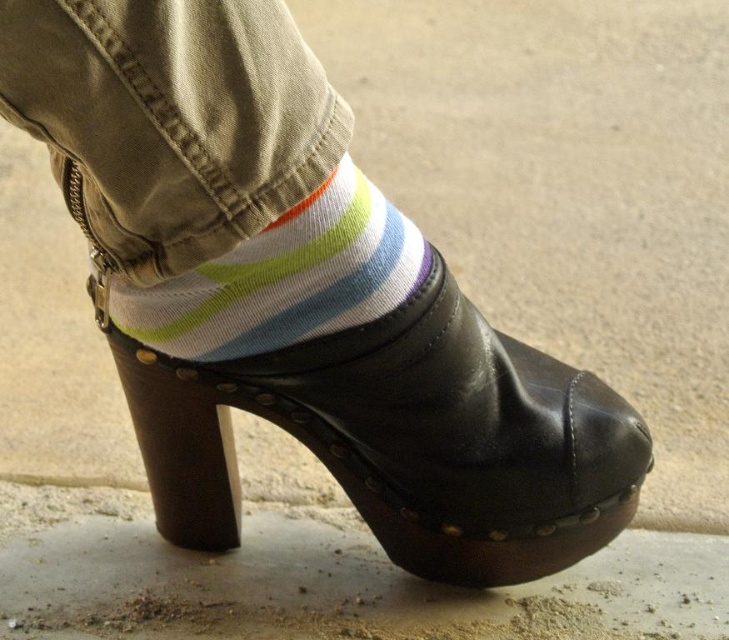
You are trying to put on your black leather clog at center, but you notice your white striped sock at center is in the way. Will the sock need to be pulled down to fit the clog properly?

The black leather clog at center is much taller than the white striped sock at center, so the sock does not need to be pulled down as it will be covered by the clog.

You are trying to put on your shoes but are unsure if your white striped sock at center will fit under the black leather clog at center. Based on the image, can you determine if the sock will fit under the clog?

The black leather clog at center is located below the white striped sock at center, meaning the sock is already positioned above the clog. Therefore, the sock is likely already in place and properly worn under the clog.

What are the coordinates of the black leather clog at center in the image?

The black leather clog at center is located at coordinates (402, 438).